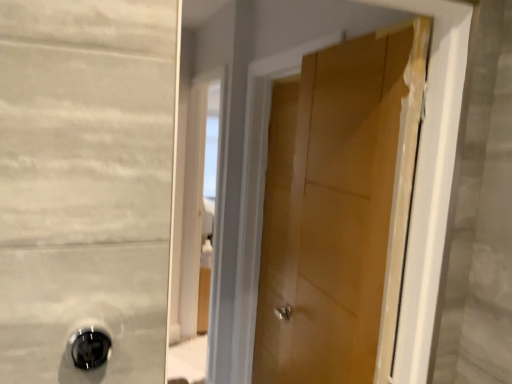
Question: Would you say black glossy door handle at lower left is to the left or to the right of wooden door at center in the picture?

Choices:
 (A) left
 (B) right

Answer: (A)

Question: Is black glossy door handle at lower left in front of or behind wooden door at center in the image?

Choices:
 (A) front
 (B) behind

Answer: (A)

Question: From a real-world perspective, relative to wooden door at center, is black glossy door handle at lower left vertically above or below?

Choices:
 (A) above
 (B) below

Answer: (A)

Question: In terms of size, does wooden door at center appear bigger or smaller than black glossy door handle at lower left?

Choices:
 (A) big
 (B) small

Answer: (A)

Question: Is wooden door at center in front of or behind black glossy door handle at lower left in the image?

Choices:
 (A) front
 (B) behind

Answer: (B)

Question: From a real-world perspective, is wooden door at center above or below black glossy door handle at lower left?

Choices:
 (A) above
 (B) below

Answer: (B)

Question: Is wooden door at center situated inside black glossy door handle at lower left or outside?

Choices:
 (A) outside
 (B) inside

Answer: (A)